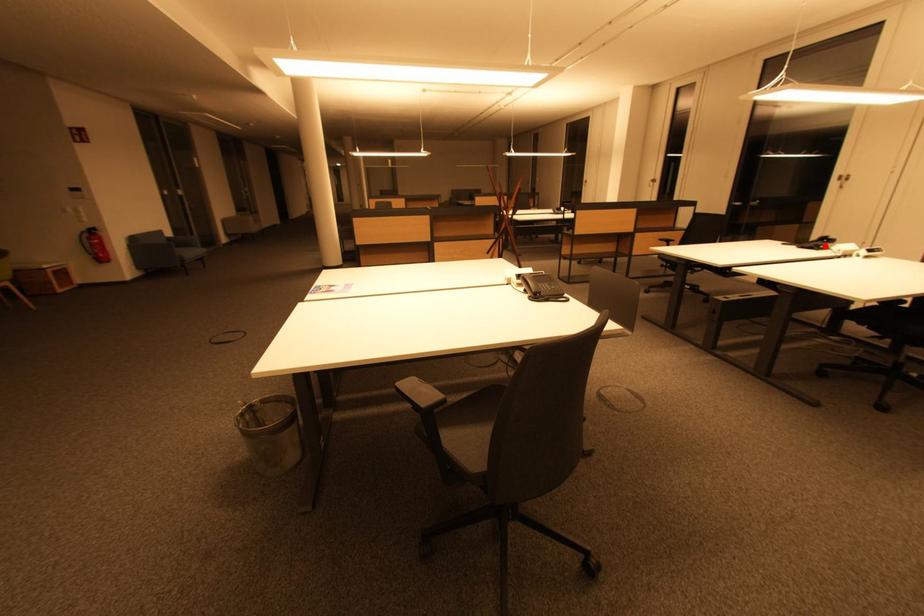
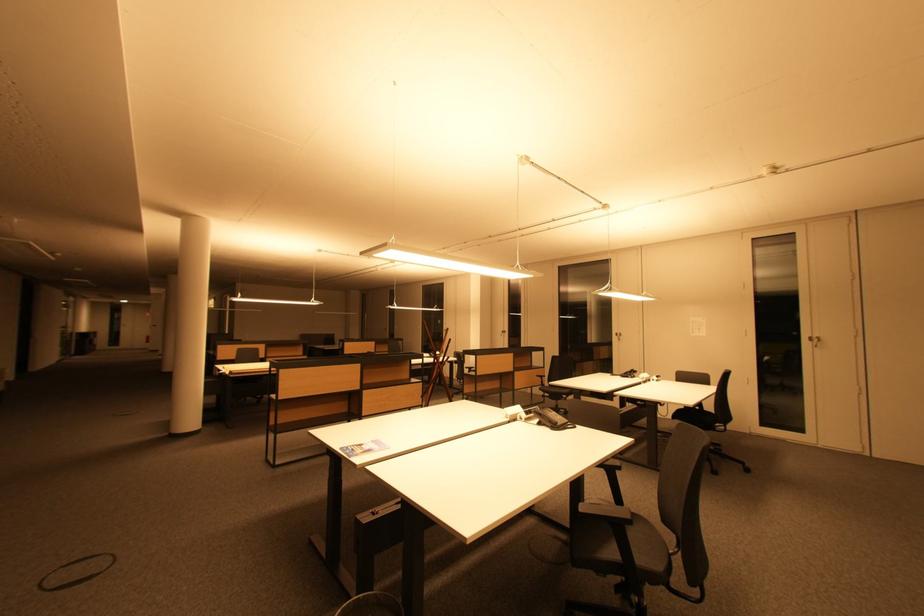
Where in the second image is the point corresponding to the highlighted location from the first image?

(635, 376)